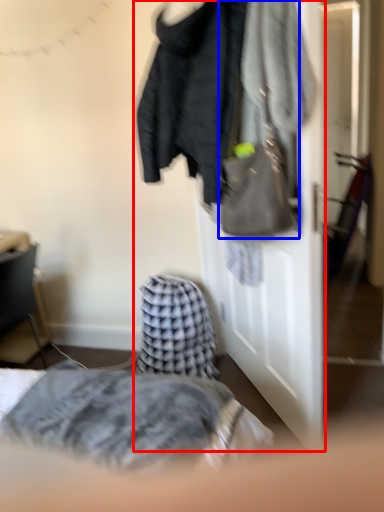
Question: Among these objects, which one is nearest to the camera, closet (highlighted by a red box) or handbag (highlighted by a blue box)?

Choices:
 (A) closet
 (B) handbag

Answer: (B)